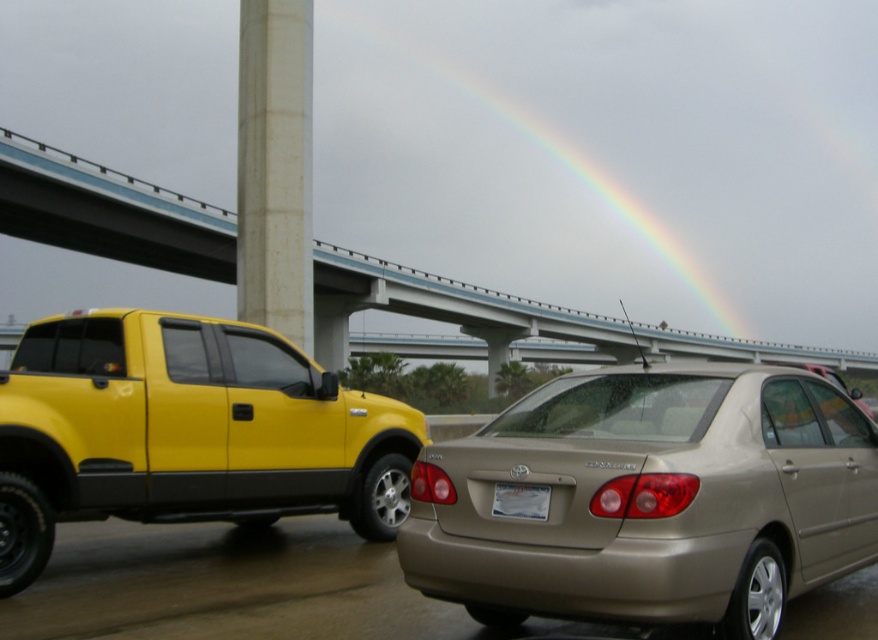
Question: Estimate the real-world distances between objects in this image. Which object is closer to the rainbow at upper center?

Choices:
 (A) shiny yellow truck at left
 (B) concrete bridge at upper center
 (C) white plastic license plate at center
 (D) gold metallic sedan at center

Answer: (B)

Question: Does rainbow at upper center appear on the left side of white plastic license plate at center?

Choices:
 (A) no
 (B) yes

Answer: (A)

Question: Does shiny yellow truck at left come in front of concrete textured column at center?

Choices:
 (A) yes
 (B) no

Answer: (A)

Question: Which point is closer to the camera taking this photo?

Choices:
 (A) (538, 493)
 (B) (493, 132)
 (C) (307, 184)
 (D) (56, 192)

Answer: (A)

Question: Which object is the farthest from the concrete bridge at upper center?

Choices:
 (A) rainbow at upper center
 (B) white plastic license plate at center
 (C) concrete textured column at center
 (D) gold metallic sedan at center

Answer: (A)

Question: Is shiny yellow truck at left smaller than concrete bridge at upper center?

Choices:
 (A) no
 (B) yes

Answer: (B)